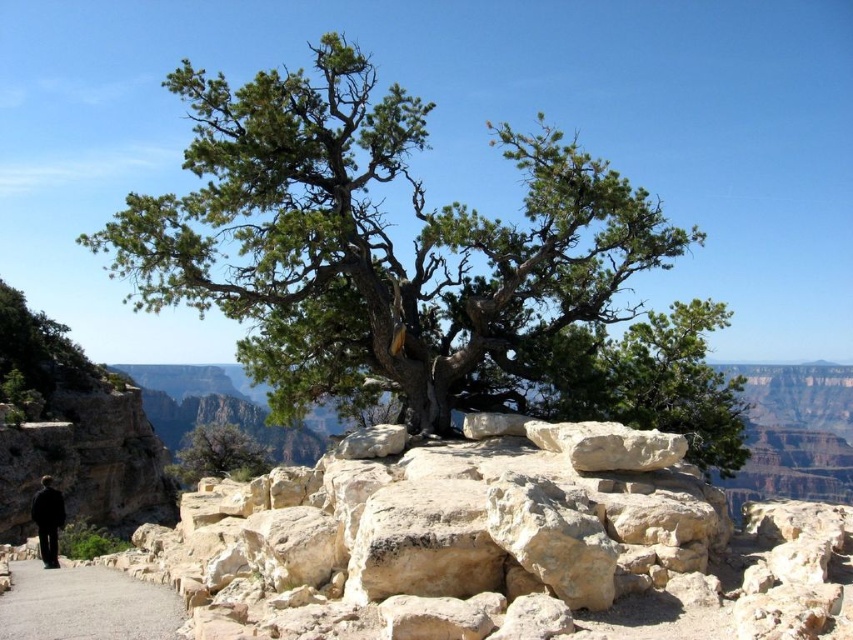
Question: Can you confirm if green textured rock at center is positioned below black fabric man at lower left?

Choices:
 (A) yes
 (B) no

Answer: (B)

Question: Does green textured rock at center appear over beige rock at center?

Choices:
 (A) no
 (B) yes

Answer: (B)

Question: Does gray gravel path at lower left come behind black fabric man at lower left?

Choices:
 (A) yes
 (B) no

Answer: (B)

Question: Among these points, which one is nearest to the camera?

Choices:
 (A) (84, 634)
 (B) (45, 497)
 (C) (219, 468)
 (D) (543, 284)

Answer: (A)

Question: Estimate the real-world distances between objects in this image. Which object is closer to the black fabric man at lower left?

Choices:
 (A) green rough bark tree at center
 (B) beige rock at center
 (C) green textured rock at center
 (D) gray gravel path at lower left

Answer: (D)

Question: Which point is closer to the camera?

Choices:
 (A) green textured rock at center
 (B) black fabric man at lower left

Answer: (B)